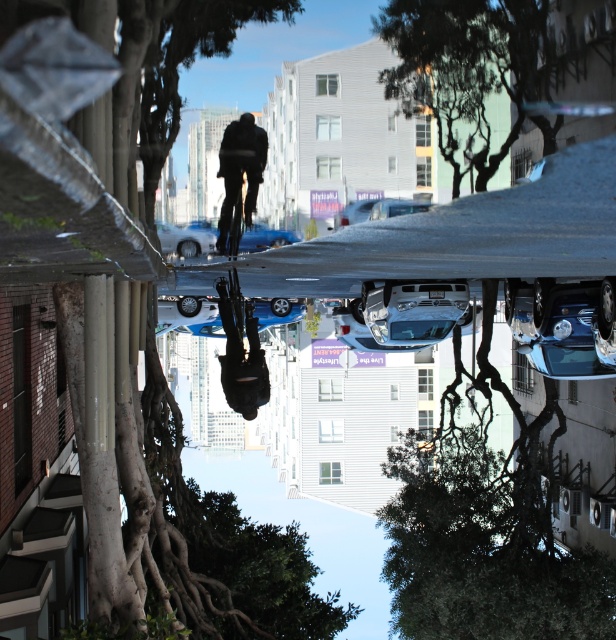
Measure the distance between shiny black helmet at center and camera.

shiny black helmet at center is 41.04 meters from camera.

I want to click on shiny black helmet at center, so click(240, 349).

Find the location of a particular element. shiny black helmet at center is located at coordinates (240, 349).

Between smooth bark tree at lower left and blue metallic car at center, which one has less height?

blue metallic car at center

Between point (120, 588) and point (200, 232), which one is positioned in front?

Point (120, 588) is more forward.

Image resolution: width=616 pixels, height=640 pixels. What are the coordinates of `smooth bark tree at lower left` in the screenshot? It's located at (92, 236).

Which of these two, smooth bark tree at lower left or shiny black helmet at center, stands shorter?

With less height is shiny black helmet at center.

How distant is smooth bark tree at lower left from shiny black helmet at center?

smooth bark tree at lower left is 46.67 feet away from shiny black helmet at center.

Who is more distant from viewer, (x=160, y=6) or (x=237, y=348)?

The point (x=237, y=348) is more distant.

Locate an element on the screen. Image resolution: width=616 pixels, height=640 pixels. smooth bark tree at lower left is located at coordinates (92, 236).